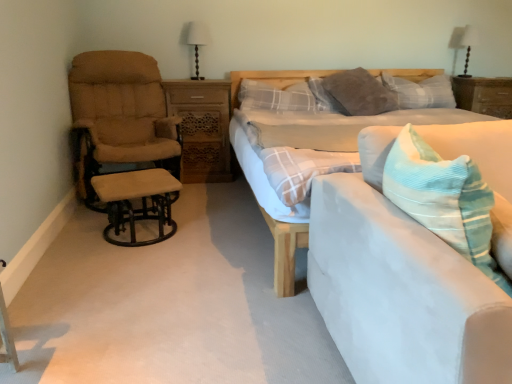
Question: Does beige fabric stool at left have a lesser height compared to wooden nightstand at right, the first nightstand positioned from the right?

Choices:
 (A) no
 (B) yes

Answer: (B)

Question: Can you confirm if beige fabric stool at left is wider than wooden nightstand at right, marked as the second nightstand in a left-to-right arrangement?

Choices:
 (A) yes
 (B) no

Answer: (A)

Question: From the image's perspective, is beige fabric stool at left under wooden nightstand at right, the first nightstand positioned from the right?

Choices:
 (A) no
 (B) yes

Answer: (B)

Question: From the image's perspective, is beige fabric stool at left on top of wooden nightstand at right, marked as the second nightstand in a left-to-right arrangement?

Choices:
 (A) no
 (B) yes

Answer: (A)

Question: Is beige fabric stool at left bigger than wooden nightstand at right, the first nightstand positioned from the right?

Choices:
 (A) no
 (B) yes

Answer: (A)

Question: Considering the positions of white fabric lampshade at upper right, which appears as the first table lamp when viewed from the right, and light blue fabric bed at center in the image, is white fabric lampshade at upper right, which appears as the first table lamp when viewed from the right, wider or thinner than light blue fabric bed at center?

Choices:
 (A) thin
 (B) wide

Answer: (A)

Question: Considering the positions of point click(471, 43) and point click(274, 77), is point click(471, 43) closer or farther from the camera than point click(274, 77)?

Choices:
 (A) closer
 (B) farther

Answer: (B)

Question: Is white fabric lampshade at upper right, which is the 2th table lamp from front to back, in front of or behind light blue fabric bed at center in the image?

Choices:
 (A) front
 (B) behind

Answer: (B)

Question: Considering the positions of white fabric lampshade at upper right, the 2th table lamp when ordered from left to right, and light blue fabric bed at center in the image, is white fabric lampshade at upper right, the 2th table lamp when ordered from left to right, bigger or smaller than light blue fabric bed at center?

Choices:
 (A) small
 (B) big

Answer: (A)

Question: From the image's perspective, is corduroy blue throw pillow at center located above or below plaid fabric pillow at center, the 2th pillow viewed from the left?

Choices:
 (A) below
 (B) above

Answer: (A)

Question: From a real-world perspective, is corduroy blue throw pillow at center physically located above or below plaid fabric pillow at center, the 2th pillow viewed from the left?

Choices:
 (A) above
 (B) below

Answer: (B)

Question: From their relative heights in the image, would you say corduroy blue throw pillow at center is taller or shorter than plaid fabric pillow at center, the 2th pillow viewed from the left?

Choices:
 (A) short
 (B) tall

Answer: (B)

Question: Based on their positions, is corduroy blue throw pillow at center located to the left or right of plaid fabric pillow at center, the 2th pillow positioned from the right?

Choices:
 (A) left
 (B) right

Answer: (A)

Question: Considering their positions, is light blue fabric bed at center located in front of or behind white fabric lampshade at upper right, which is the 2th table lamp from front to back?

Choices:
 (A) front
 (B) behind

Answer: (A)

Question: Considering the positions of point (269, 135) and point (456, 28), is point (269, 135) closer or farther from the camera than point (456, 28)?

Choices:
 (A) farther
 (B) closer

Answer: (B)